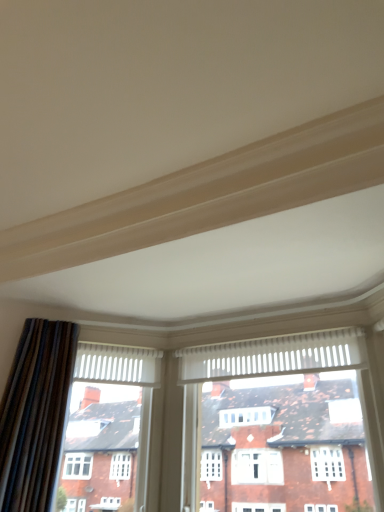
Question: Is velvet-like brown curtain at left behind white textured window at center?

Choices:
 (A) no
 (B) yes

Answer: (A)

Question: Is velvet-like brown curtain at left completely or partially outside of white textured window at center?

Choices:
 (A) yes
 (B) no

Answer: (A)

Question: From a real-world perspective, is velvet-like brown curtain at left below white textured window at center?

Choices:
 (A) yes
 (B) no

Answer: (B)

Question: Does velvet-like brown curtain at left lie in front of white textured window at center?

Choices:
 (A) no
 (B) yes

Answer: (B)

Question: Can you confirm if velvet-like brown curtain at left is shorter than white textured window at center?

Choices:
 (A) yes
 (B) no

Answer: (B)

Question: Is velvet-like brown curtain at left far from white textured window at center?

Choices:
 (A) yes
 (B) no

Answer: (A)

Question: Does white textured window at center have a greater height compared to velvet-like brown curtain at left?

Choices:
 (A) yes
 (B) no

Answer: (B)

Question: From the image's perspective, is white textured window at center located beneath velvet-like brown curtain at left?

Choices:
 (A) no
 (B) yes

Answer: (B)

Question: Does white textured window at center have a larger size compared to velvet-like brown curtain at left?

Choices:
 (A) no
 (B) yes

Answer: (B)

Question: Is white textured window at center turned away from velvet-like brown curtain at left?

Choices:
 (A) yes
 (B) no

Answer: (B)

Question: From a real-world perspective, is white textured window at center under velvet-like brown curtain at left?

Choices:
 (A) no
 (B) yes

Answer: (B)

Question: From the image's perspective, is white textured window at center located above velvet-like brown curtain at left?

Choices:
 (A) no
 (B) yes

Answer: (A)

Question: From a real-world perspective, relative to velvet-like brown curtain at left, is white textured window at center vertically above or below?

Choices:
 (A) below
 (B) above

Answer: (A)